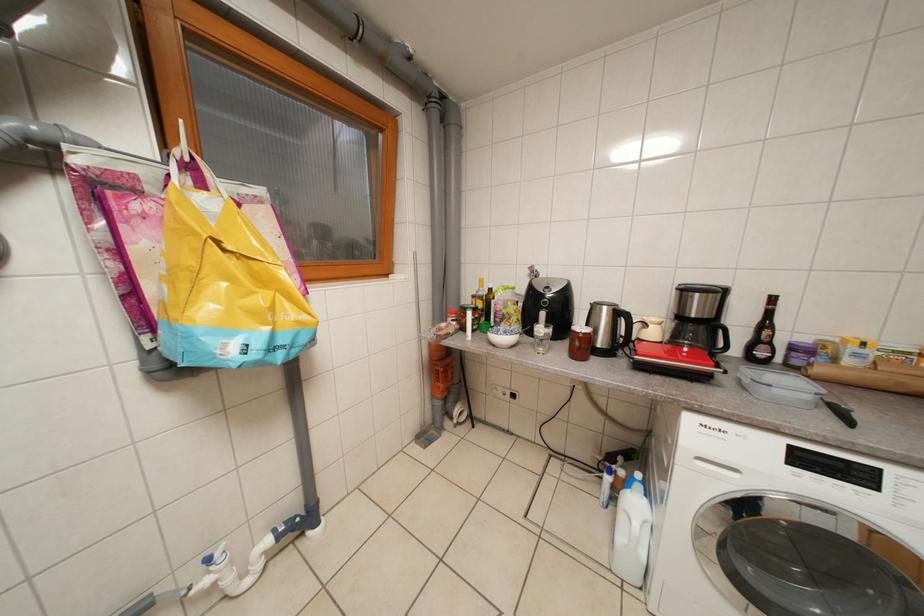
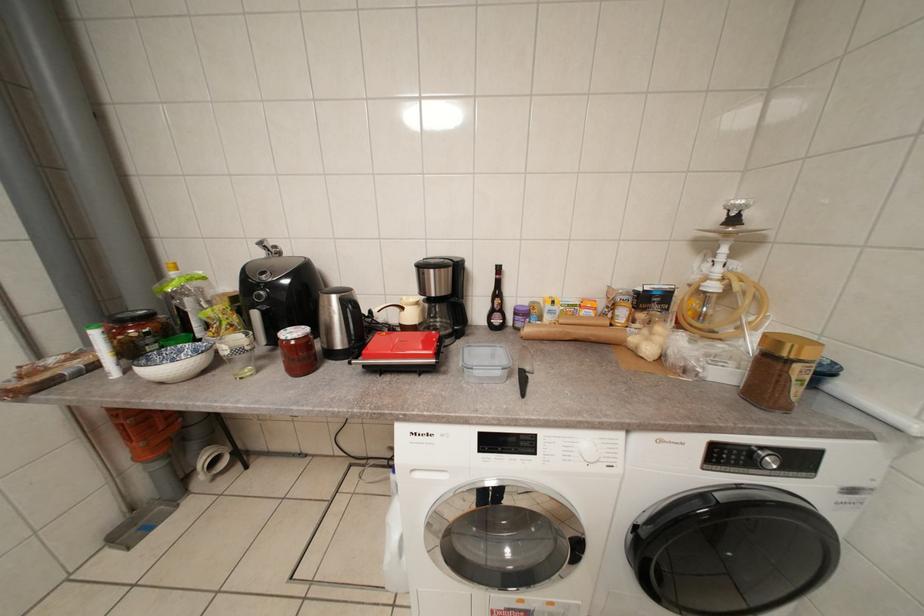
Question: The camera is either moving clockwise (left) or counter-clockwise (right) around the object. The first image is from the beginning of the video and the second image is from the end. Is the camera moving left or right when shooting the video?

Choices:
 (A) Left
 (B) Right

Answer: (A)